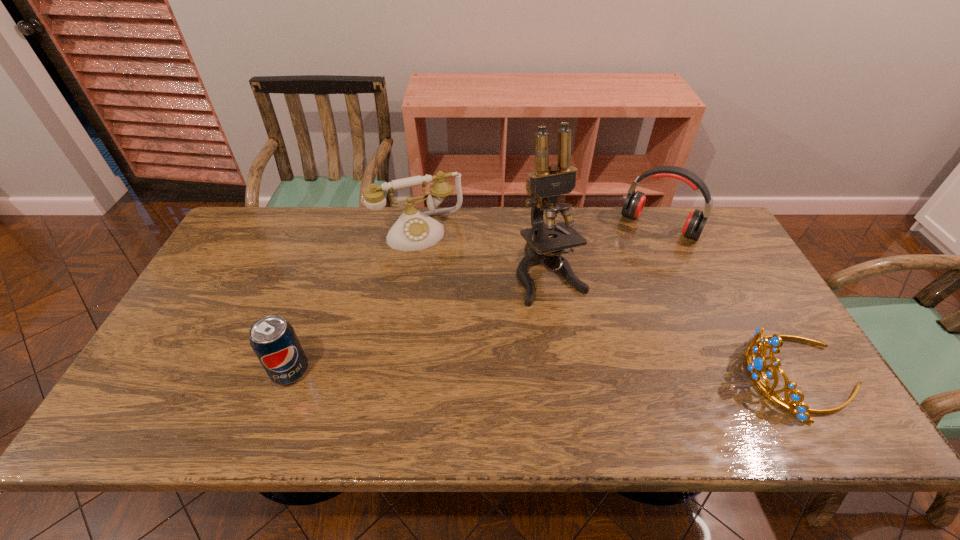
At what (x,y) coordinates should I click in order to perform the action: click on free space on the desktop that is between the soda can and the tiara and is positioned at the eyepieces of the microscope. Please return your answer as a coordinate pair (x, y). Image resolution: width=960 pixels, height=540 pixels. Looking at the image, I should click on (608, 374).

Find the location of `vacant spot on the desktop that is between the leftmost object and the tiara and is positioned on the dial of the telephone`. vacant spot on the desktop that is between the leftmost object and the tiara and is positioned on the dial of the telephone is located at coordinates (475, 373).

Image resolution: width=960 pixels, height=540 pixels. What are the coordinates of `free space on the desktop that is between the leftmost object and the tiara and is positioned on the ear cups of the earphone` in the screenshot? It's located at tap(576, 374).